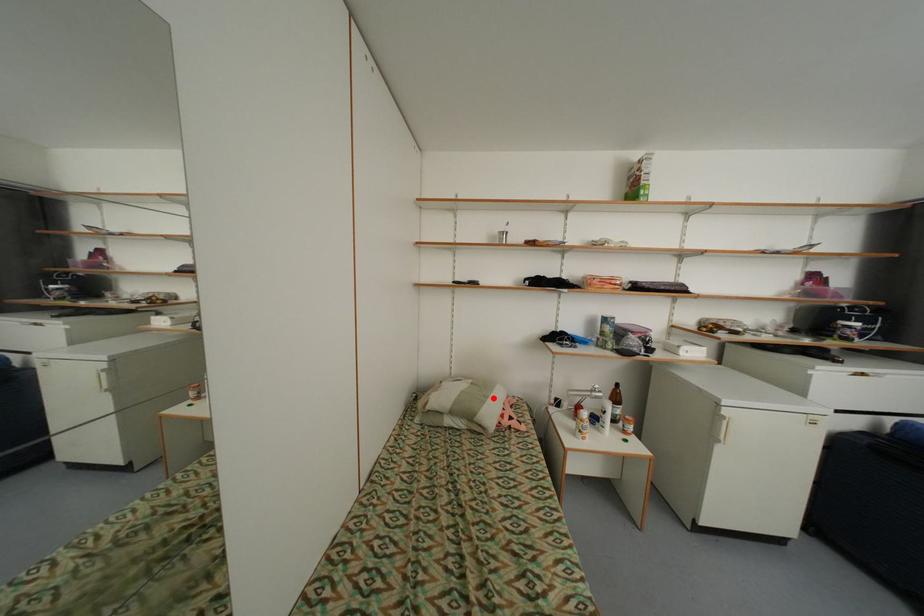
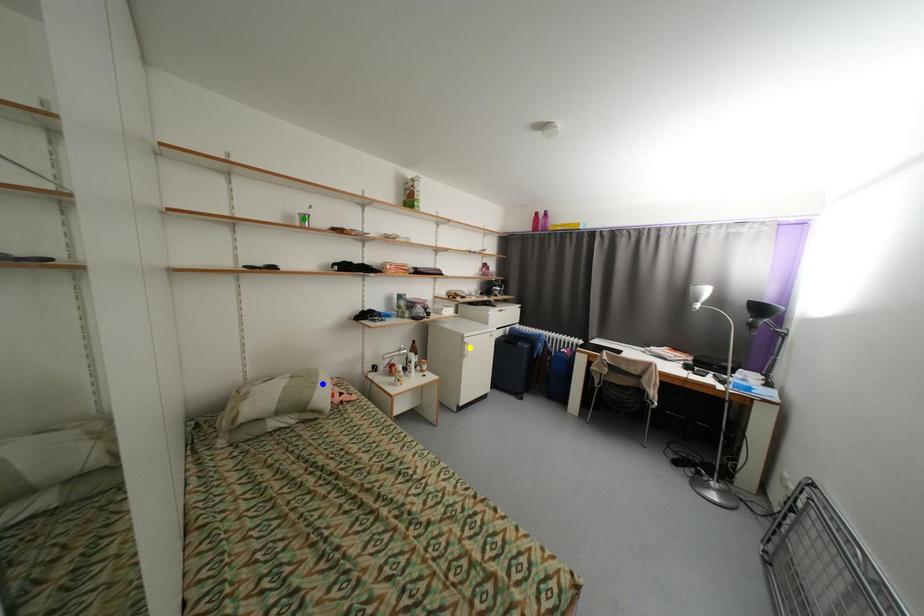
Question: I am providing you with two images of the same scene from different viewpoints. A red point is marked on the first image. You are given multiple points on the second image. Which mark in image 2 goes with the point in image 1?

Choices:
 (A) yellow point
 (B) blue point
 (C) green point

Answer: (B)